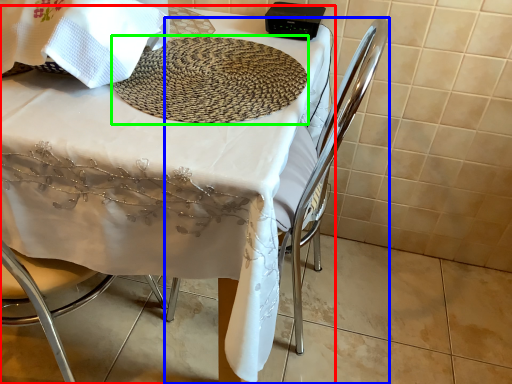
Question: Based on their relative distances, which object is nearer to table (highlighted by a red box)? Choose from chair (highlighted by a blue box) and mat (highlighted by a green box).

Choices:
 (A) chair
 (B) mat

Answer: (B)